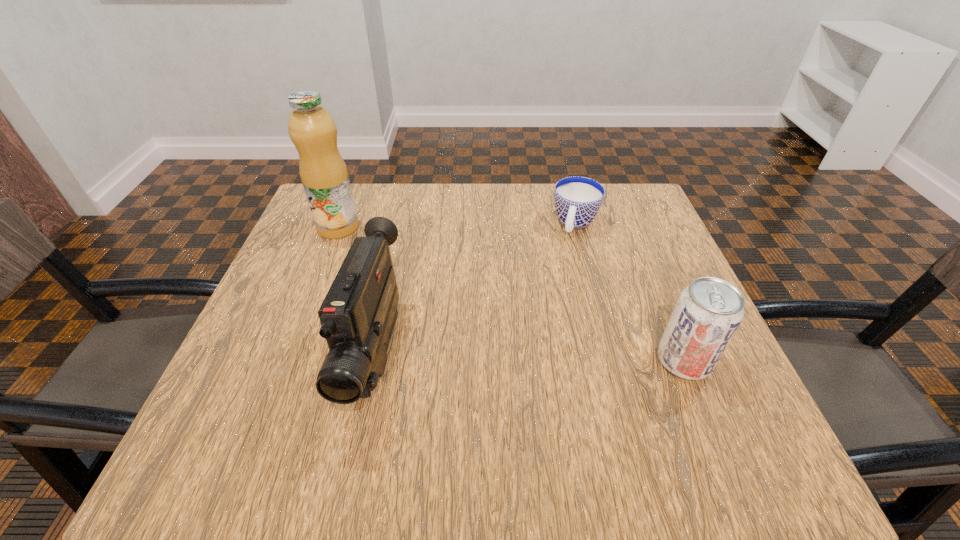
This screenshot has height=540, width=960. What are the coordinates of `soda can that is positioned at the right edge` in the screenshot? It's located at (708, 312).

I want to click on cup at the right edge, so click(577, 199).

The width and height of the screenshot is (960, 540). In order to click on object at the far left corner in this screenshot , I will do [324, 175].

The width and height of the screenshot is (960, 540). Identify the location of object that is at the far right corner. (577, 199).

Locate an element on the screen. The image size is (960, 540). object situated at the near right corner is located at coordinates (708, 312).

This screenshot has width=960, height=540. I want to click on blank area at the far edge, so click(x=404, y=226).

At what (x,y) coordinates should I click in order to perform the action: click on vacant space at the left edge of the desktop. Please return your answer as a coordinate pair (x, y). The width and height of the screenshot is (960, 540). Looking at the image, I should click on (256, 318).

Image resolution: width=960 pixels, height=540 pixels. Identify the location of free region at the right edge of the desktop. (652, 281).

What are the coordinates of `free space at the far left corner` in the screenshot? It's located at (307, 219).

In the image, there is a desktop. Where is `free region at the far right corner`? This screenshot has width=960, height=540. free region at the far right corner is located at coordinates (605, 226).